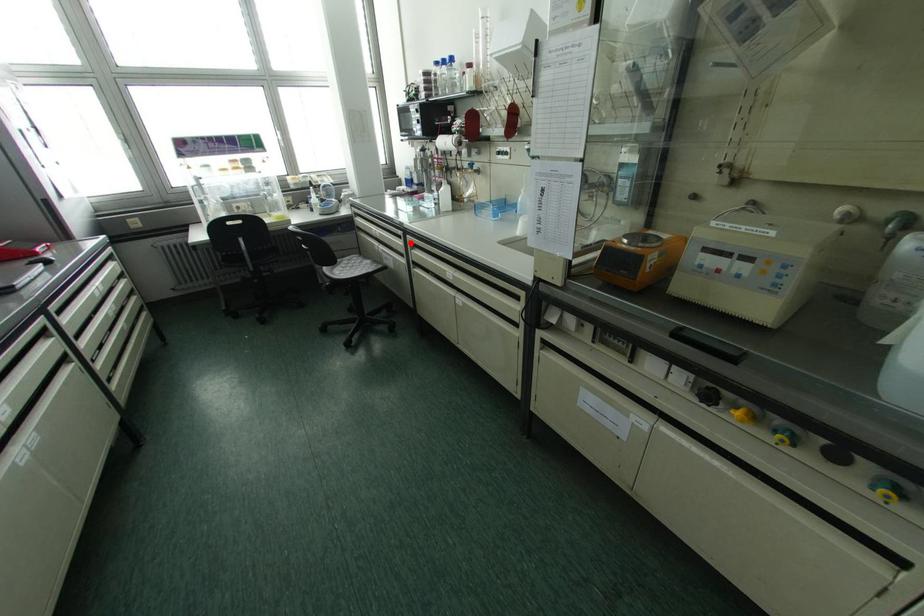
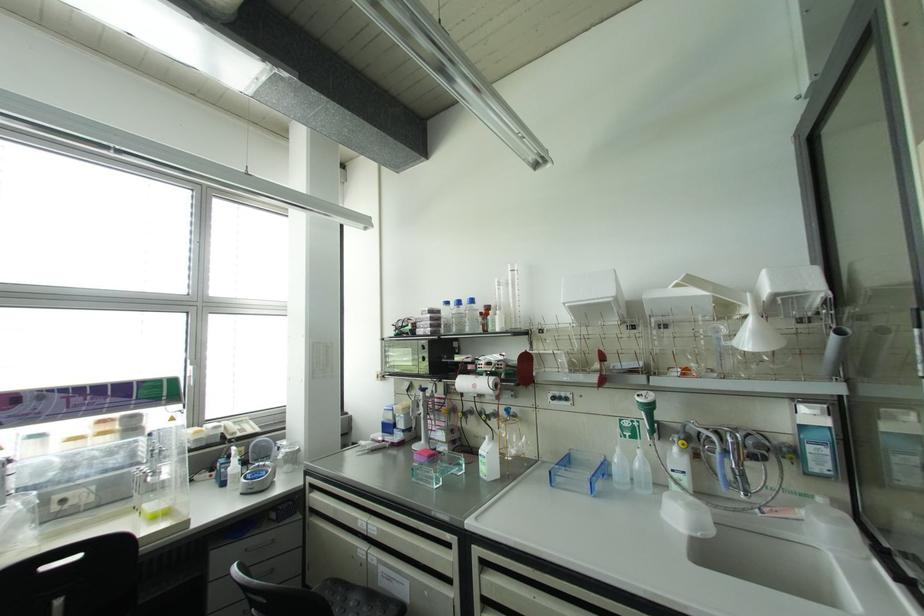
Question: I am providing you with two images of the same scene from different viewpoints. A red point is shown in image1. For the corresponding object point in image2, is it positioned nearer or farther from the camera?

Choices:
 (A) Nearer
 (B) Farther

Answer: (B)